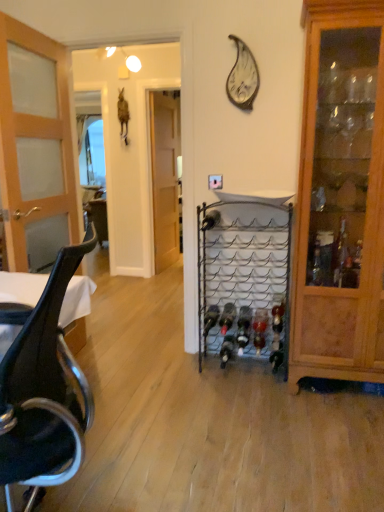
This screenshot has width=384, height=512. What are the coordinates of `vacant space in front of black glass wine bottle at center, which appears as the 2th wine bottle when viewed from the left` in the screenshot? It's located at (237, 380).